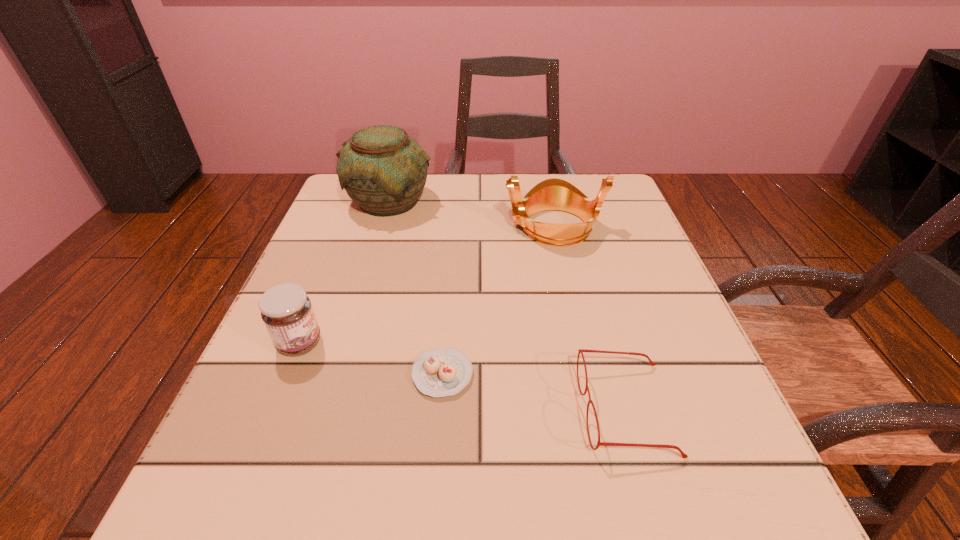
Point out which object is positioned as the fourth nearest to the tiara. Please provide its 2D coordinates. Your answer should be formatted as a tuple, i.e. [(x, y)], where the tuple contains the x and y coordinates of a point satisfying the conditions above.

[(286, 310)]

At what (x,y) coordinates should I click in order to perform the action: click on vacant space that satisfies the following two spatial constraints: 1. on the front label of the shortest object; 2. on the left side of the third shortest object. Please return your answer as a coordinate pair (x, y). Image resolution: width=960 pixels, height=540 pixels. Looking at the image, I should click on (287, 374).